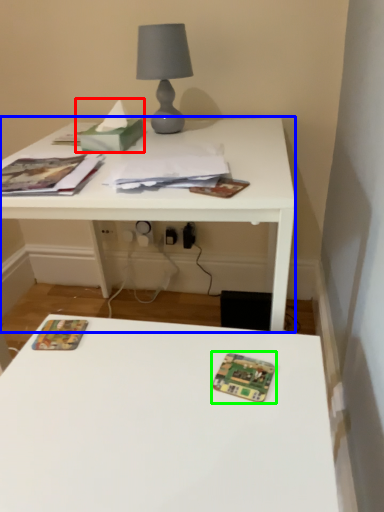
Question: Based on their relative distances, which object is nearer to tissue (highlighted by a red box)? Choose from table (highlighted by a blue box) and card game (highlighted by a green box).

Choices:
 (A) table
 (B) card game

Answer: (A)